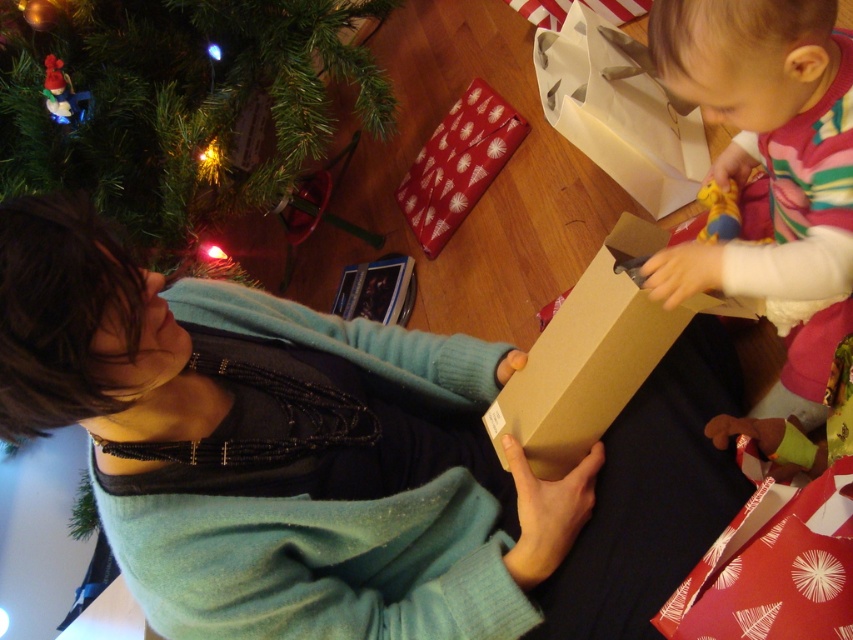
Question: Which of these objects is positioned farthest from the matte brown box at center?

Choices:
 (A) striped fleece sweater at lower right
 (B) green matte christmas tree at upper left
 (C) brown cardboard box at center

Answer: (B)

Question: Observing the image, what is the correct spatial positioning of matte brown box at center in reference to green matte christmas tree at upper left?

Choices:
 (A) left
 (B) right

Answer: (B)

Question: Can you confirm if green matte christmas tree at upper left is positioned to the left of brown cardboard box at center?

Choices:
 (A) no
 (B) yes

Answer: (B)

Question: Can you confirm if striped fleece sweater at lower right is positioned to the right of brown cardboard box at center?

Choices:
 (A) yes
 (B) no

Answer: (A)

Question: Which is nearer to the matte brown box at center?

Choices:
 (A) striped fleece sweater at lower right
 (B) green matte christmas tree at upper left

Answer: (A)

Question: Which object is the farthest from the brown cardboard box at center?

Choices:
 (A) green matte christmas tree at upper left
 (B) matte brown box at center

Answer: (A)